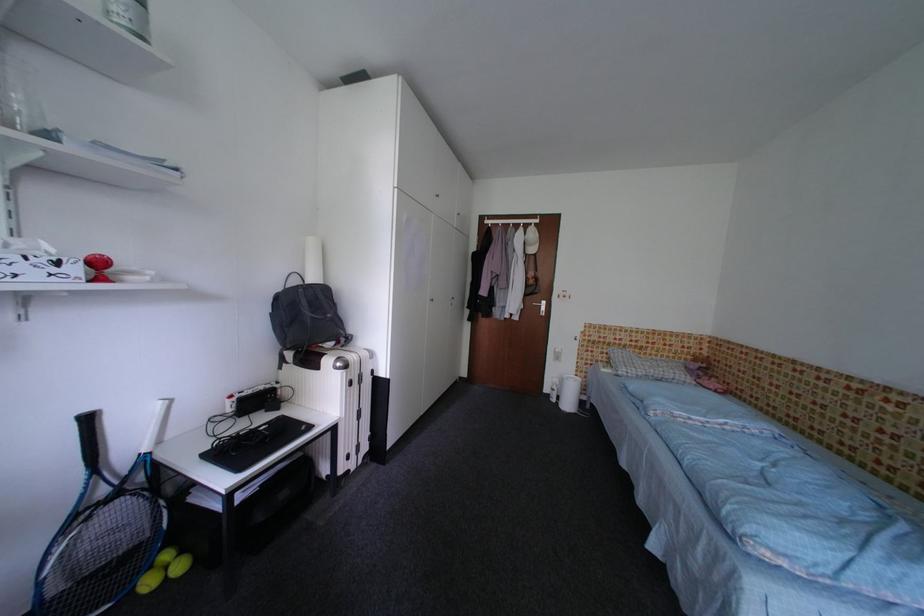
Where is `black keyboard`? This screenshot has height=616, width=924. black keyboard is located at coordinates point(253,443).